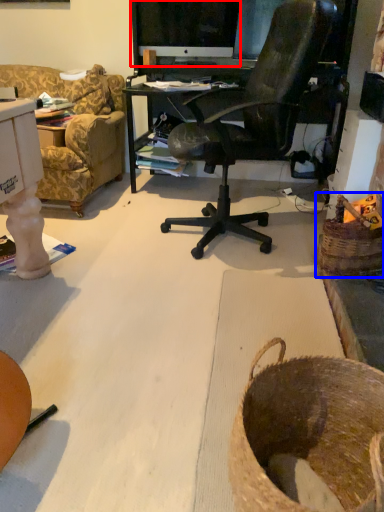
Question: Which object appears closest to the camera in this image, computer monitor (highlighted by a red box) or basket (highlighted by a blue box)?

Choices:
 (A) computer monitor
 (B) basket

Answer: (B)